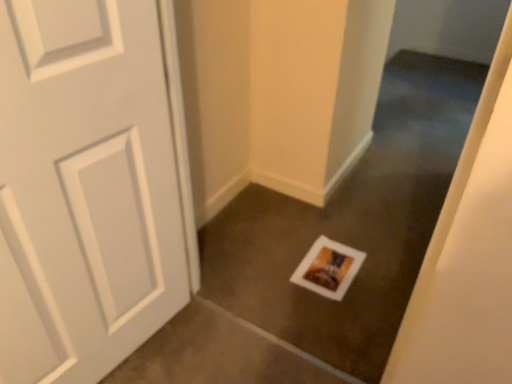
Question: Is white matte picture frame at center to the left of white matte postcard at center from the viewer's perspective?

Choices:
 (A) yes
 (B) no

Answer: (A)

Question: Is white matte picture frame at center located outside white matte postcard at center?

Choices:
 (A) yes
 (B) no

Answer: (A)

Question: From a real-world perspective, is white matte picture frame at center on white matte postcard at center?

Choices:
 (A) yes
 (B) no

Answer: (A)

Question: From the image's perspective, is white matte picture frame at center under white matte postcard at center?

Choices:
 (A) no
 (B) yes

Answer: (A)

Question: Does white matte picture frame at center appear on the right side of white matte postcard at center?

Choices:
 (A) yes
 (B) no

Answer: (B)

Question: Can you confirm if white matte picture frame at center is taller than white matte postcard at center?

Choices:
 (A) yes
 (B) no

Answer: (A)

Question: Is white matte postcard at center aimed at white matte picture frame at center?

Choices:
 (A) yes
 (B) no

Answer: (A)

Question: Is white matte picture frame at center located within white matte postcard at center?

Choices:
 (A) yes
 (B) no

Answer: (B)

Question: Is white matte postcard at center thinner than white matte picture frame at center?

Choices:
 (A) no
 (B) yes

Answer: (A)

Question: From a real-world perspective, is white matte postcard at center below white matte picture frame at center?

Choices:
 (A) no
 (B) yes

Answer: (B)

Question: Is white matte postcard at center wider than white matte picture frame at center?

Choices:
 (A) yes
 (B) no

Answer: (A)

Question: Considering the relative sizes of white matte postcard at center and white matte picture frame at center in the image provided, is white matte postcard at center shorter than white matte picture frame at center?

Choices:
 (A) yes
 (B) no

Answer: (A)

Question: Considering the positions of white matte postcard at center and white matte picture frame at center in the image, is white matte postcard at center wider or thinner than white matte picture frame at center?

Choices:
 (A) wide
 (B) thin

Answer: (A)